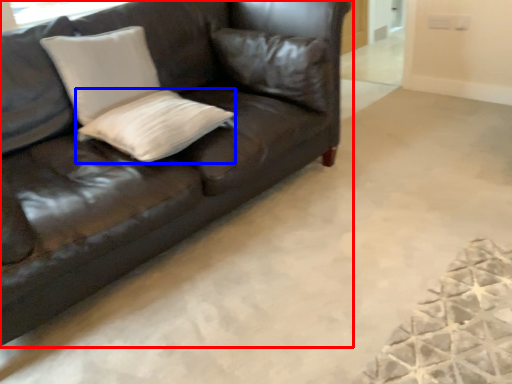
Question: Which point is closer to the camera, studio couch (highlighted by a red box) or pillow (highlighted by a blue box)?

Choices:
 (A) studio couch
 (B) pillow

Answer: (A)